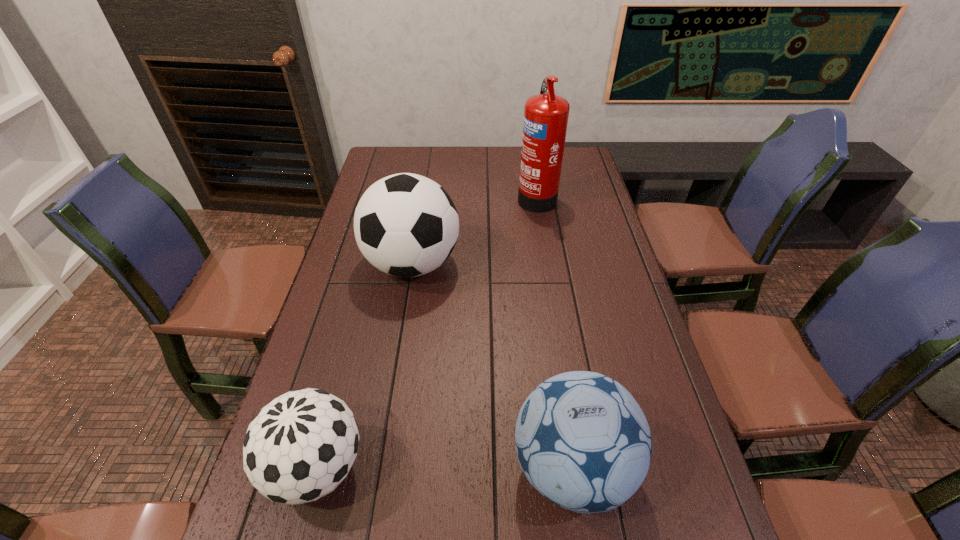
Identify the location of the farthest object. This screenshot has width=960, height=540. (546, 115).

Identify the location of the tallest object. The image size is (960, 540). (546, 115).

Find the location of `the third shortest object`. the third shortest object is located at coordinates (406, 225).

Image resolution: width=960 pixels, height=540 pixels. Find the location of `the farthest soccer ball`. the farthest soccer ball is located at coordinates [x=406, y=225].

You are a GUI agent. You are given a task and a screenshot of the screen. Output one action in this format:
    pyautogui.click(x=<x>, y=<y>)
    Task: Click on the rightmost soccer ball
    
    Given the screenshot: What is the action you would take?
    pyautogui.click(x=583, y=442)

Image resolution: width=960 pixels, height=540 pixels. Identify the location of the second shortest object. (583, 442).

I want to click on the shortest object, so click(299, 447).

This screenshot has height=540, width=960. What are the coordinates of `vacant space located 0.320m on the surface of the fire extinguisher` in the screenshot? It's located at (431, 196).

At what (x,y) coordinates should I click in order to perform the action: click on vacant space situated 0.340m on the surface of the fire extinguisher. Please return your answer as a coordinate pair (x, y). The image size is (960, 540). Looking at the image, I should click on (425, 196).

You are a GUI agent. You are given a task and a screenshot of the screen. Output one action in this format:
    pyautogui.click(x=<x>, y=<y>)
    Task: Click on the free location located on the surface of the fire extinguisher
    Image resolution: width=960 pixels, height=540 pixels.
    Given the screenshot: What is the action you would take?
    pyautogui.click(x=425, y=196)